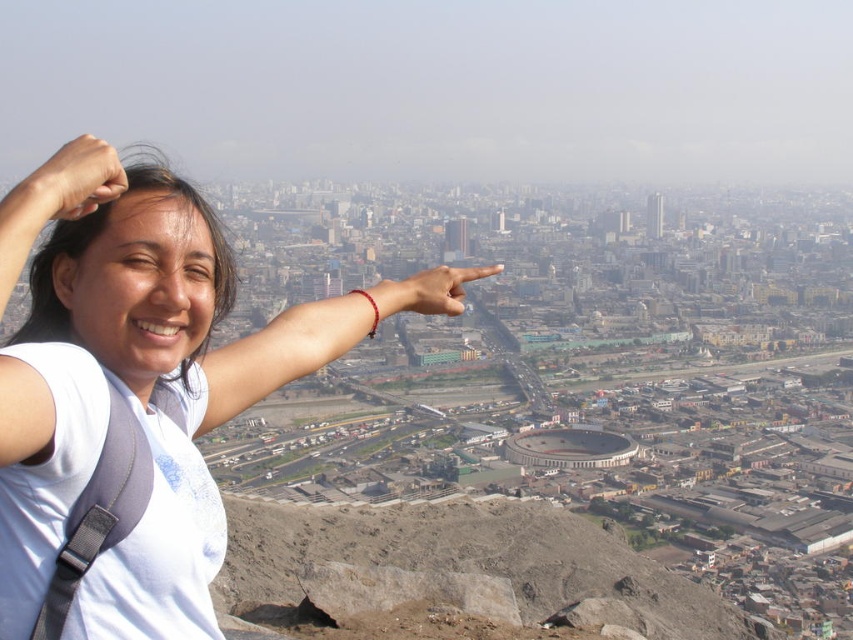
You are a photographer trying to capture the scene from the image. You want to ensure that both the white matte shirt at upper left and the matte skin hand at center are visible in your photo. Based on their positions, which object should you frame first to include both in the shot?

The white matte shirt at upper left is to the left of the matte skin hand at center, so you should frame the white matte shirt at upper left first to ensure both are included in the shot.

You are a photographer aiming to capture the dull gray rock at center and the matte skin hand at center in a single shot. Based on their positions, could you adjust your camera angle so that the hand appears in front of the rock?

The matte skin hand at center is behind the dull gray rock at center, so adjusting the camera angle would not make the hand appear in front. The hand is currently positioned behind the rock, so it would still be obscured unless physically moved.